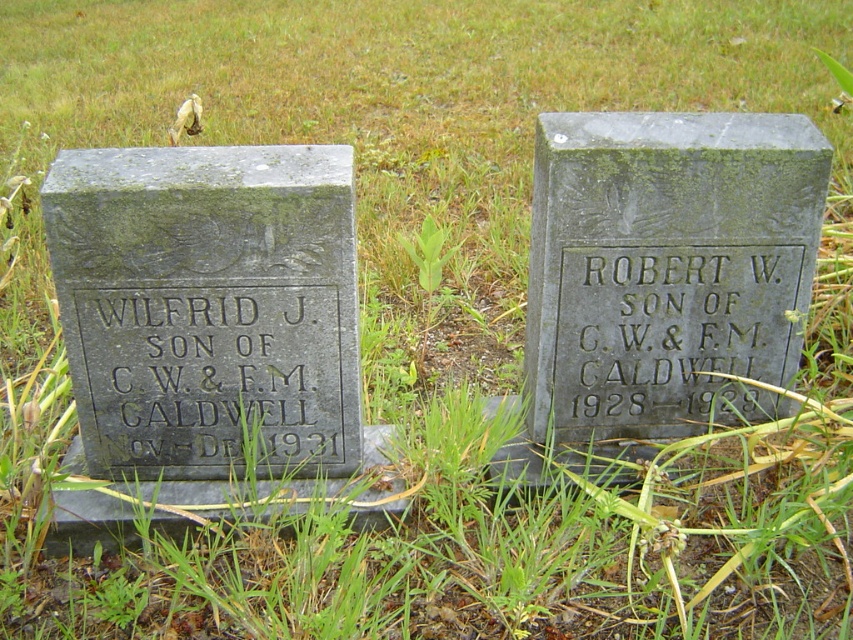
Question: Among these objects, which one is farthest from the camera?

Choices:
 (A) black stone gravestone at left
 (B) gray stone gravestone at right

Answer: (A)

Question: Can you confirm if gray stone gravestone at left is positioned below black stone gravestone at left?

Choices:
 (A) no
 (B) yes

Answer: (A)

Question: Which point appears farthest from the camera in this image?

Choices:
 (A) (634, 298)
 (B) (787, 337)
 (C) (125, 292)
 (D) (254, 369)

Answer: (B)

Question: Is black stone gravestone at left wider than black granite gravestone at center right?

Choices:
 (A) yes
 (B) no

Answer: (B)

Question: Which point is closer to the camera taking this photo?

Choices:
 (A) pyautogui.click(x=187, y=417)
 (B) pyautogui.click(x=340, y=385)
 (C) pyautogui.click(x=651, y=406)
 (D) pyautogui.click(x=764, y=288)

Answer: (B)

Question: Can you confirm if black stone gravestone at left is positioned to the right of black granite gravestone at center right?

Choices:
 (A) no
 (B) yes

Answer: (A)